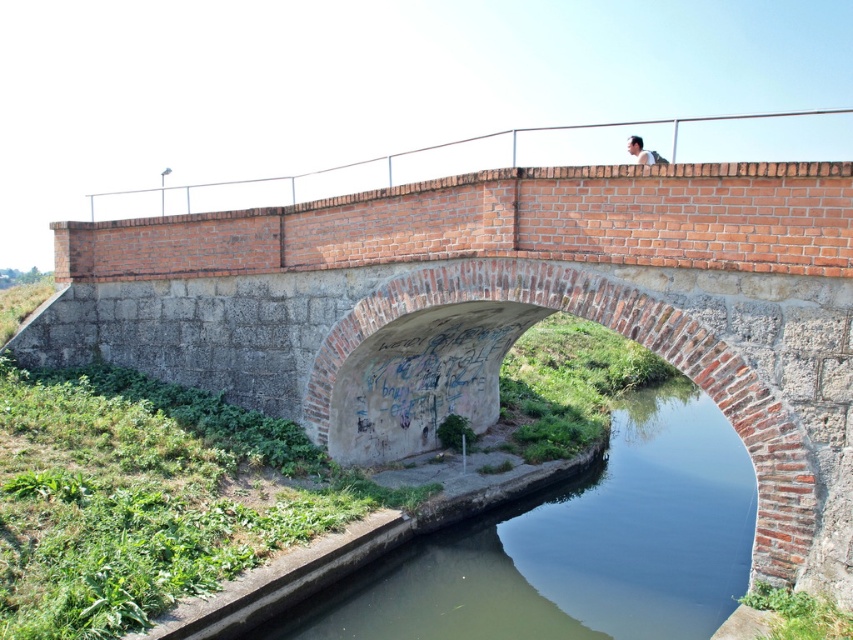
Question: Can you confirm if green concrete river at center is positioned to the left of white shirt at upper center?

Choices:
 (A) no
 (B) yes

Answer: (B)

Question: Which of the following is the closest to the observer?

Choices:
 (A) white metal rail at upper center
 (B) green concrete river at center

Answer: (B)

Question: Which of these objects is positioned closest to the white metal rail at upper center?

Choices:
 (A) green concrete river at center
 (B) white shirt at upper center

Answer: (B)

Question: Can you confirm if green concrete river at center is positioned above white shirt at upper center?

Choices:
 (A) no
 (B) yes

Answer: (A)

Question: Where is green concrete river at center located in relation to white metal rail at upper center in the image?

Choices:
 (A) below
 (B) above

Answer: (A)

Question: Which of the following is the farthest from the observer?

Choices:
 (A) green concrete river at center
 (B) white shirt at upper center
 (C) white metal rail at upper center

Answer: (C)